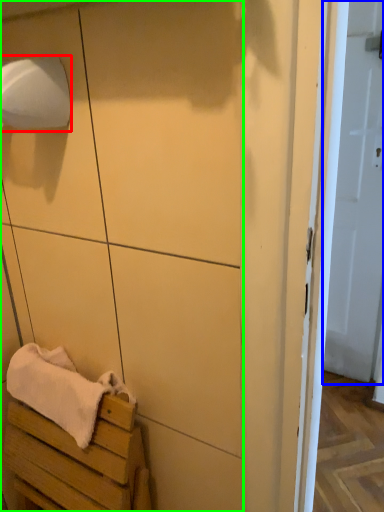
Question: Estimate the real-world distances between objects in this image. Which object is closer to toilet paper (highlighted by a red box), door (highlighted by a blue box) or cabinetry (highlighted by a green box)?

Choices:
 (A) door
 (B) cabinetry

Answer: (B)